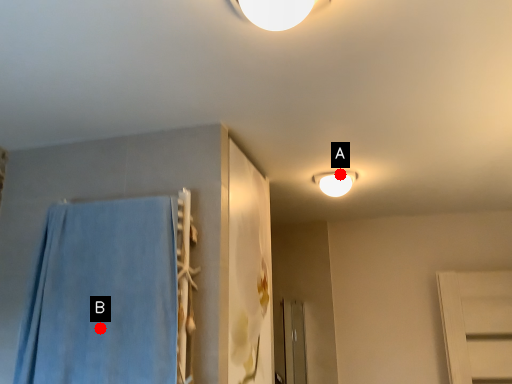
Question: Two points are circled on the image, labeled by A and B beside each circle. Which point is farther to the camera?

Choices:
 (A) A is further
 (B) B is further

Answer: (A)